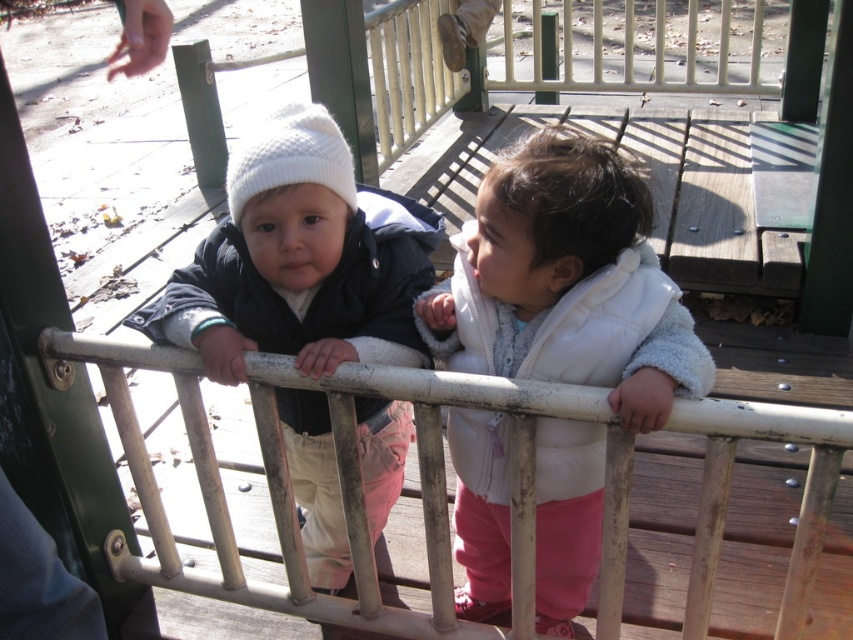
Question: Can you confirm if white fleece vest at center is smaller than white metal rail at center?

Choices:
 (A) no
 (B) yes

Answer: (B)

Question: Is white metal rail at center positioned at the back of matte white beanie at center?

Choices:
 (A) no
 (B) yes

Answer: (A)

Question: Can you confirm if white fleece vest at center is positioned to the left of white knitted hat at upper center?

Choices:
 (A) no
 (B) yes

Answer: (A)

Question: Which of the following is the closest to the observer?

Choices:
 (A) white metal rail at center
 (B) white knitted hat at upper center
 (C) white fleece vest at center

Answer: (A)

Question: Which of the following is the closest to the observer?

Choices:
 (A) matte white beanie at center
 (B) white metal rail at center
 (C) white knitted hat at upper center

Answer: (B)

Question: Which object is the farthest from the matte white beanie at center?

Choices:
 (A) white knitted hat at upper center
 (B) white metal rail at center

Answer: (A)